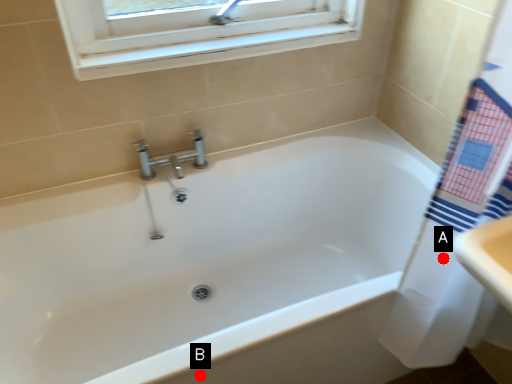
Question: Two points are circled on the image, labeled by A and B beside each circle. Which point appears closest to the camera in this image?

Choices:
 (A) A is closer
 (B) B is closer

Answer: (B)